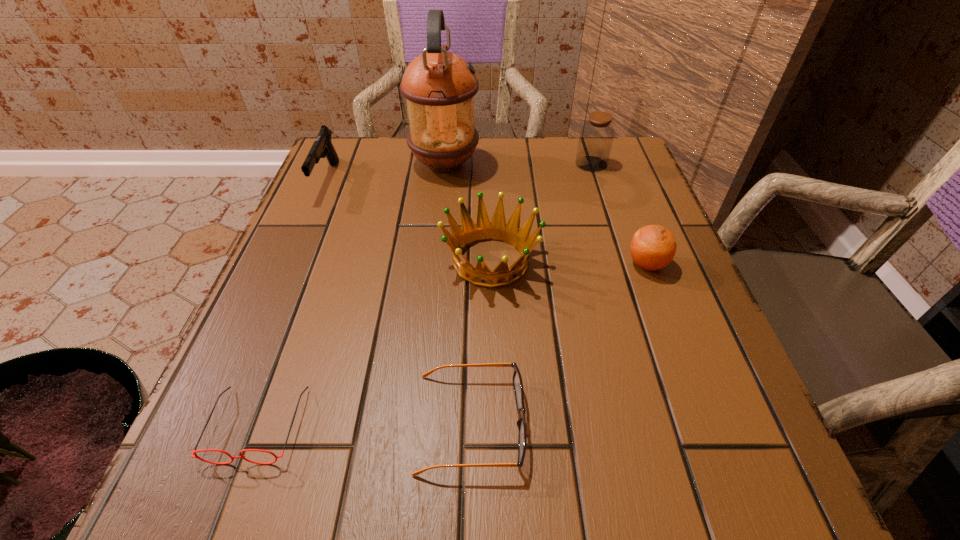
At what (x,y) coordinates should I click in order to perform the action: click on object present at the far left corner. Please return your answer as a coordinate pair (x, y). Looking at the image, I should click on (322, 147).

Locate an element on the screen. The image size is (960, 540). object that is positioned at the near left corner is located at coordinates click(194, 452).

The image size is (960, 540). In order to click on object that is at the far right corner in this screenshot , I will do `click(596, 137)`.

Where is `free location at the far edge of the desktop`? The image size is (960, 540). free location at the far edge of the desktop is located at coordinates (539, 183).

Identify the location of vacant space at the left edge. The width and height of the screenshot is (960, 540). (300, 438).

At what (x,y) coordinates should I click in order to perform the action: click on free region at the right edge of the desktop. Please return your answer as a coordinate pair (x, y). Image resolution: width=960 pixels, height=540 pixels. Looking at the image, I should click on (597, 240).

This screenshot has height=540, width=960. In the image, there is a desktop. Identify the location of vacant space at the far left corner. (353, 184).

Where is `free region at the near left corner of the desktop`? The height and width of the screenshot is (540, 960). free region at the near left corner of the desktop is located at coordinates (274, 451).

Where is `vacant space at the far right corner`? vacant space at the far right corner is located at coordinates (633, 175).

The width and height of the screenshot is (960, 540). Identify the location of free area in between the crown and the orange. (569, 262).